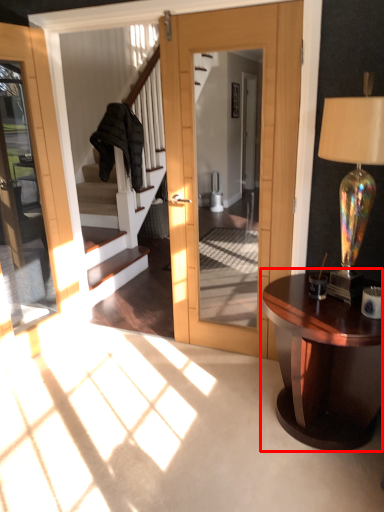
Question: From the image, what is the correct spatial relationship of table (annotated by the red box) in relation to lamp?

Choices:
 (A) left
 (B) right

Answer: (A)